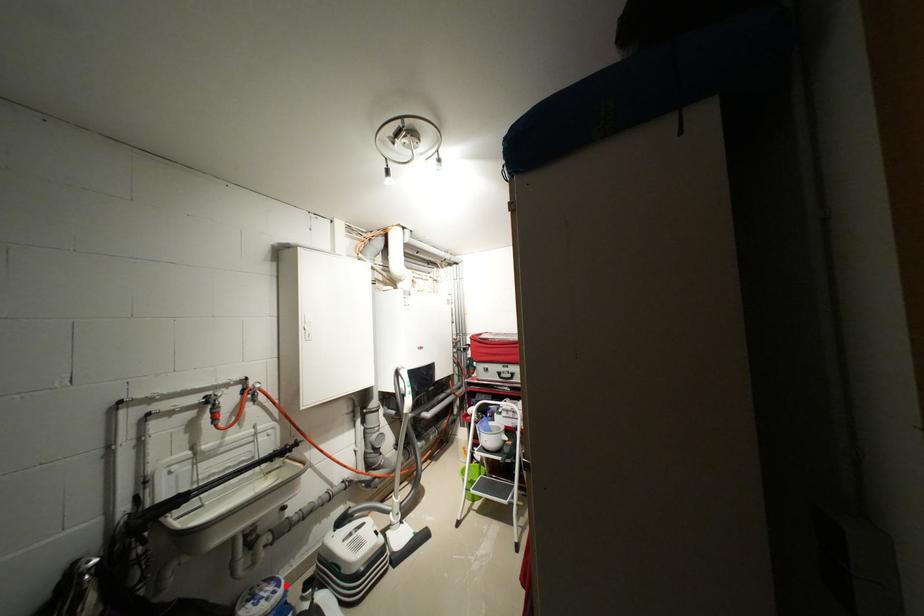
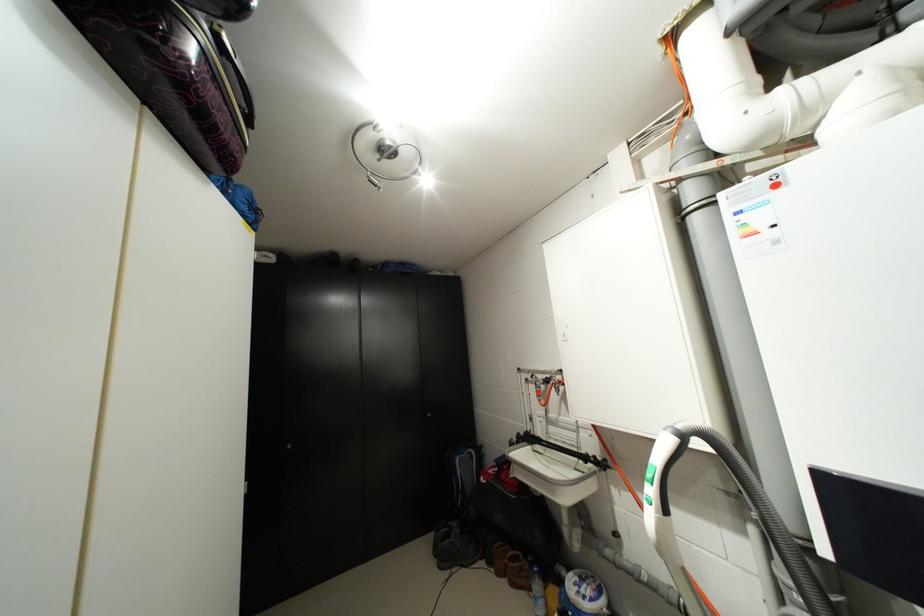
In the second image, find the point that corresponds to the highlighted location in the first image.

(599, 600)